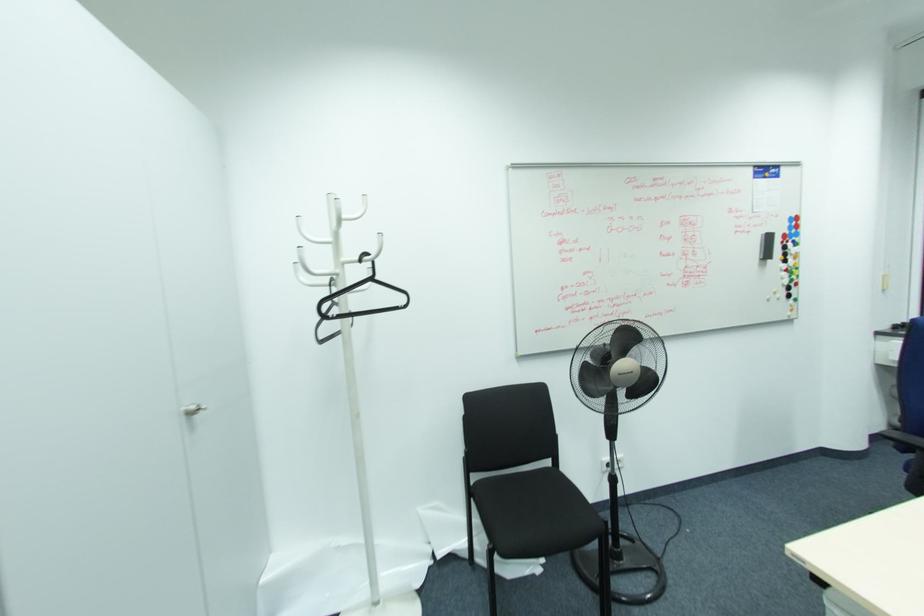
Find where to sit the black chair sitting surface. Please return your answer as a coordinate pair (x, y).

(535, 513)